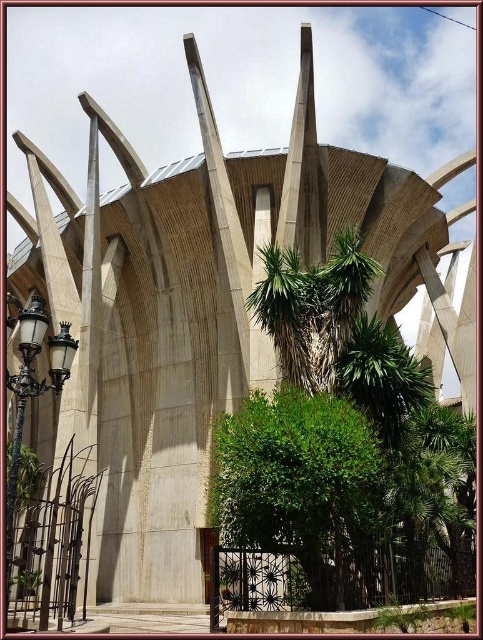
You are a landscape architect planning to place a new tree in the scene. The new tree has a trunk width of 30 cm. Which object between the green leafy bush at center and the polished brass streetlight at lower left would you place the tree closer to, based on their widths?

The green leafy bush at center is thinner than the polished brass streetlight at lower left. Since the new tree has a trunk width of 30 cm, it would be appropriate to place it closer to the polished brass streetlight at lower left, which is wider, to maintain proportional harmony in the design.

You are standing in front of the building and see the green leafy tree at center and the green leafy bush at center. Which one is more to the right?

The green leafy tree at center is positioned on the right side of green leafy bush at center, so it is more to the right.